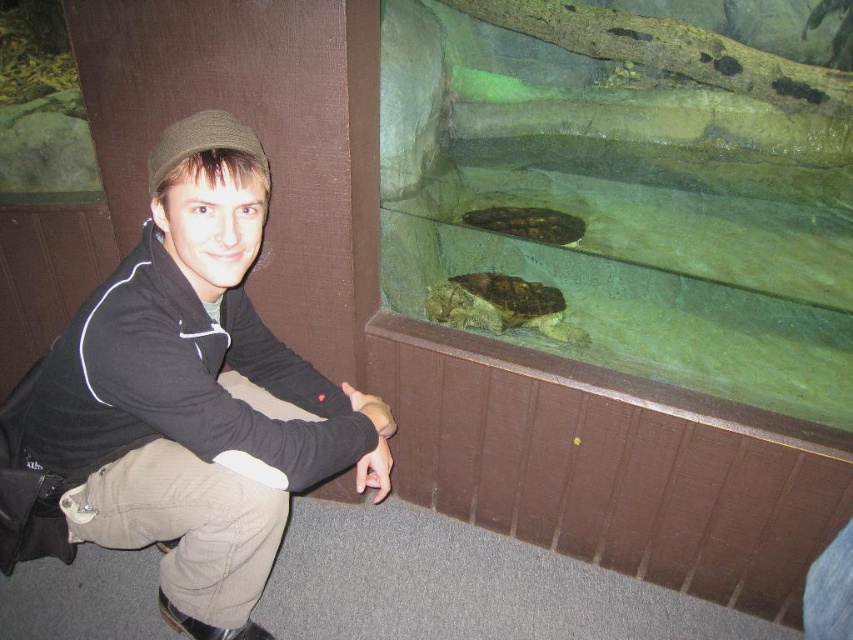
Question: Which point is farther to the camera?

Choices:
 (A) (219, 291)
 (B) (457, 296)

Answer: (B)

Question: Which point is closer to the camera taking this photo?

Choices:
 (A) pyautogui.click(x=454, y=284)
 (B) pyautogui.click(x=473, y=218)
 (C) pyautogui.click(x=123, y=435)

Answer: (C)

Question: Which point is closer to the camera taking this photo?

Choices:
 (A) click(584, 224)
 (B) click(97, 500)
 (C) click(495, 278)

Answer: (B)

Question: Can you confirm if black matte jacket at lower left is positioned to the right of brown scaly turtle at center?

Choices:
 (A) no
 (B) yes

Answer: (A)

Question: Is black matte jacket at lower left above brown matte turtle at upper center?

Choices:
 (A) no
 (B) yes

Answer: (A)

Question: Can you confirm if brown scaly turtle at center is positioned above brown matte turtle at upper center?

Choices:
 (A) no
 (B) yes

Answer: (A)